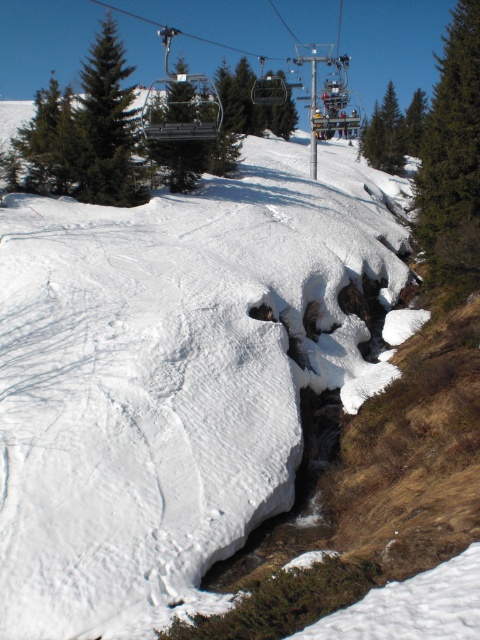
Which is more to the left, green textured pine at right or green matte pine at upper left?

green matte pine at upper left

Does green textured pine at right have a greater height compared to green matte pine at upper left?

Answer: No, green textured pine at right is not taller than green matte pine at upper left.

Who is more distant from viewer, (453, 28) or (98, 65)?

Positioned behind is point (453, 28).

Find the location of a particular element. This screenshot has height=640, width=480. green textured pine at right is located at coordinates (453, 156).